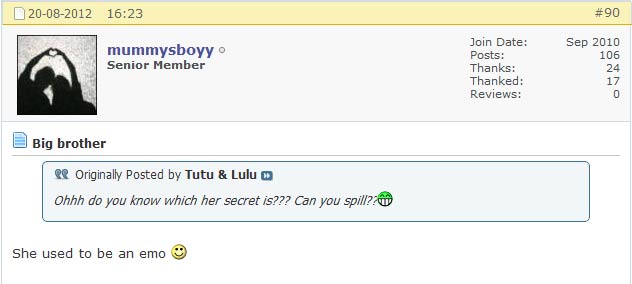
Identify the location of box. The image size is (632, 284). (406, 169).